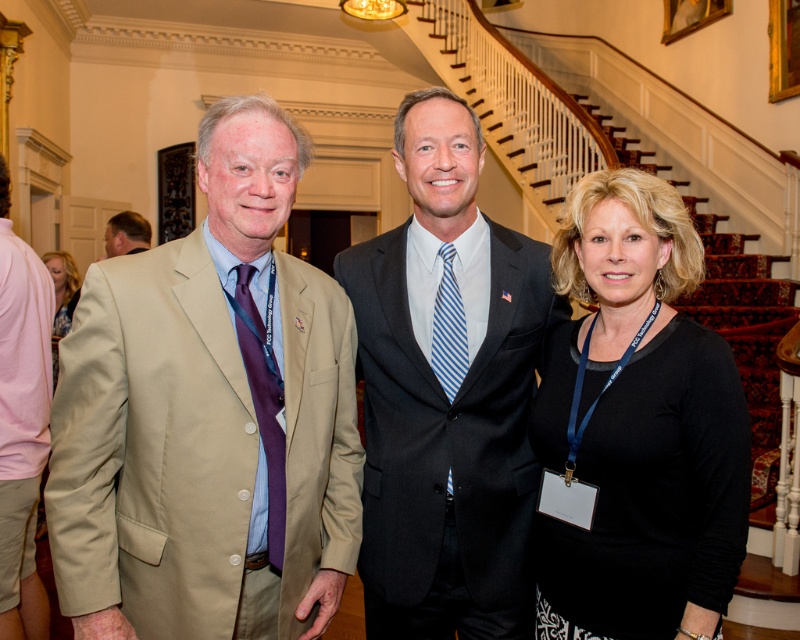
How much distance is there between black matte shirt at center and blue striped tie at center?

black matte shirt at center and blue striped tie at center are 16.88 inches apart.

Does point (604, 500) come in front of point (446, 353)?

Yes.

Where is `black matte shirt at center`? The width and height of the screenshot is (800, 640). black matte shirt at center is located at coordinates (637, 426).

Who is positioned more to the left, pink cotton shirt at left or matte beige suit at left?

Positioned to the left is matte beige suit at left.

Can you confirm if pink cotton shirt at left is wider than matte beige suit at left?

Incorrect, pink cotton shirt at left's width does not surpass matte beige suit at left's.

Is point (2, 230) less distant than point (137, 243)?

Yes, it is in front of point (137, 243).

Find the location of a particular element. This screenshot has width=800, height=640. pink cotton shirt at left is located at coordinates (22, 422).

Does dark gray suit at center appear over matte pink dress at left?

No, dark gray suit at center is not above matte pink dress at left.

Is dark gray suit at center below matte pink dress at left?

Yes, dark gray suit at center is below matte pink dress at left.

Which is behind, point (564, 300) or point (57, 278)?

Positioned behind is point (57, 278).

The height and width of the screenshot is (640, 800). In order to click on dark gray suit at center in this screenshot , I will do `click(448, 392)`.